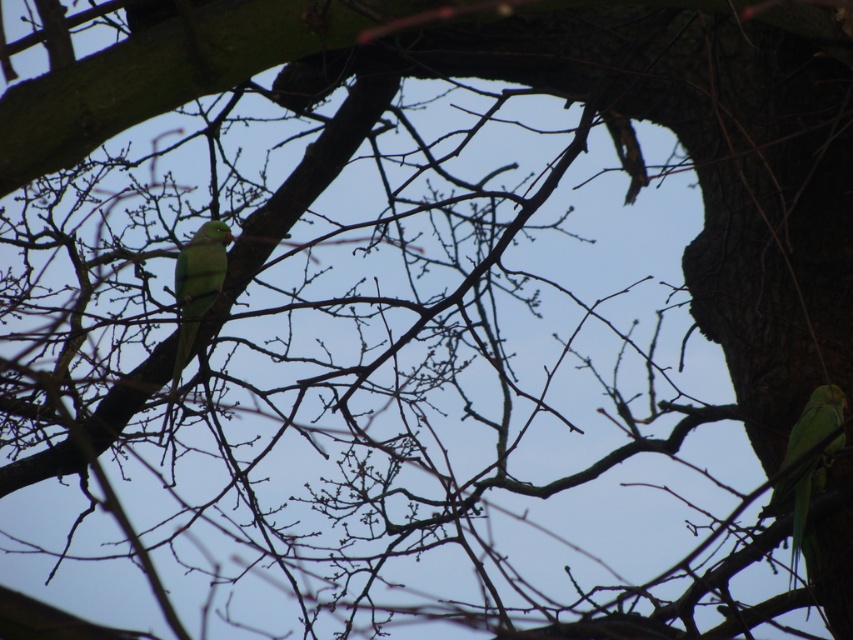
Question: From the image, what is the correct spatial relationship of green matte parrot at right in relation to green matte parrot at center?

Choices:
 (A) right
 (B) left

Answer: (A)

Question: Which object is closer to the camera taking this photo?

Choices:
 (A) green matte parrot at right
 (B) green matte parrot at center

Answer: (A)

Question: Can you confirm if green matte parrot at right is positioned above green matte parrot at center?

Choices:
 (A) yes
 (B) no

Answer: (B)

Question: Does green matte parrot at right appear over green matte parrot at center?

Choices:
 (A) no
 (B) yes

Answer: (A)

Question: Which point is closer to the camera?

Choices:
 (A) (833, 416)
 (B) (194, 312)

Answer: (A)